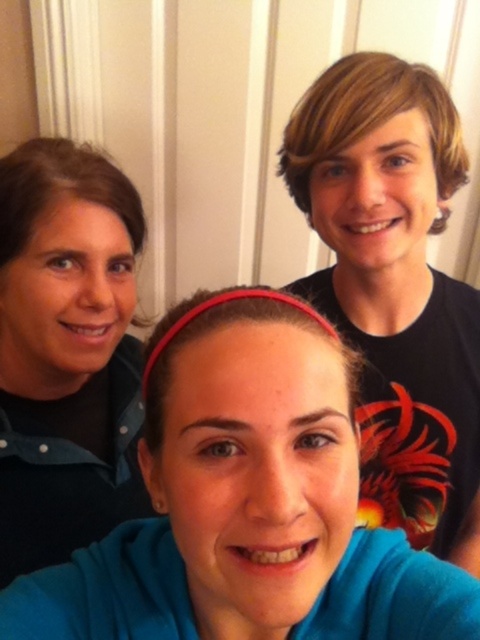
Question: Which of the following is the farthest from the observer?

Choices:
 (A) blue fleece at center
 (B) matte black shirt at left
 (C) black matte shirt at upper right

Answer: (B)

Question: Which of the following is the closest to the observer?

Choices:
 (A) (115, 513)
 (B) (439, 141)

Answer: (B)

Question: Does blue fleece at center have a lesser width compared to matte black shirt at left?

Choices:
 (A) no
 (B) yes

Answer: (A)

Question: Considering the relative positions of blue fleece at center and matte black shirt at left in the image provided, where is blue fleece at center located with respect to matte black shirt at left?

Choices:
 (A) left
 (B) right

Answer: (B)

Question: Does black matte shirt at upper right have a smaller size compared to matte black shirt at left?

Choices:
 (A) no
 (B) yes

Answer: (A)

Question: Estimate the real-world distances between objects in this image. Which object is farther from the black matte shirt at upper right?

Choices:
 (A) matte black shirt at left
 (B) blue fleece at center

Answer: (B)